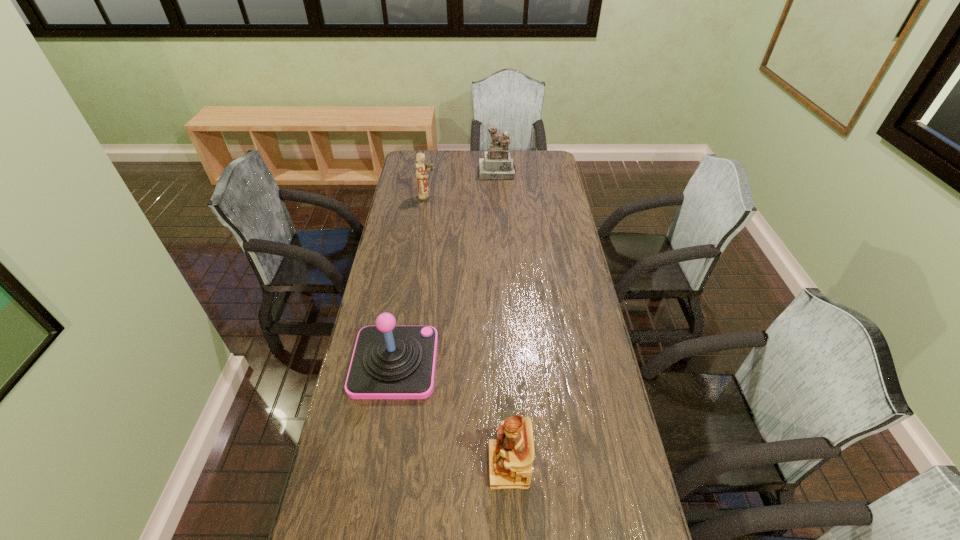
Locate an element on the screen. This screenshot has height=540, width=960. blank area located forward from the base of the joystick is located at coordinates click(471, 362).

Where is `object present at the far edge`? Image resolution: width=960 pixels, height=540 pixels. object present at the far edge is located at coordinates point(497,164).

I want to click on figurine that is at the left edge, so click(x=424, y=195).

This screenshot has height=540, width=960. I want to click on joystick that is at the left edge, so click(389, 362).

In the image, there is a desktop. Where is `vacant space at the far edge`? vacant space at the far edge is located at coordinates (442, 155).

The width and height of the screenshot is (960, 540). In order to click on vacant space at the left edge in this screenshot , I will do `click(323, 511)`.

At what (x,y) coordinates should I click in order to perform the action: click on vacant area at the right edge of the desktop. Please return your answer as a coordinate pair (x, y). The image size is (960, 540). Looking at the image, I should click on (556, 203).

Locate an element on the screen. This screenshot has height=540, width=960. free region at the far right corner is located at coordinates (523, 151).

Locate an element on the screen. free space between the nearest figurine and the joystick is located at coordinates pos(451,414).

Locate an element on the screen. free point between the farthest object and the joystick is located at coordinates (445, 267).